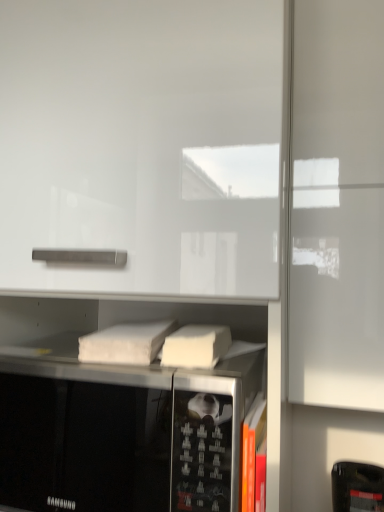
Question: Is black matte microwave oven at center wider than white matte book at center, arranged as the 1th book when viewed from the top?

Choices:
 (A) no
 (B) yes

Answer: (B)

Question: Is black matte microwave oven at center thinner than white matte book at center, which is the 2th book from right to left?

Choices:
 (A) yes
 (B) no

Answer: (B)

Question: Is black matte microwave oven at center facing away from white matte book at center, which is the 2th book from right to left?

Choices:
 (A) yes
 (B) no

Answer: (B)

Question: Does black matte microwave oven at center have a greater height compared to white matte book at center, which is counted as the 1th book, starting from the left?

Choices:
 (A) no
 (B) yes

Answer: (B)

Question: Would you consider black matte microwave oven at center to be distant from white matte book at center, the second book from the bottom?

Choices:
 (A) no
 (B) yes

Answer: (A)

Question: From the image's perspective, is black matte microwave oven at center below white matte book at center, which is the 2th book from right to left?

Choices:
 (A) yes
 (B) no

Answer: (A)

Question: Could you tell me if white matte book at center, the second book from the bottom, is turned towards black matte microwave oven at center?

Choices:
 (A) yes
 (B) no

Answer: (B)

Question: Is white matte book at center, the second book from the front, far away from black matte microwave oven at center?

Choices:
 (A) yes
 (B) no

Answer: (B)

Question: Is white matte book at center, the second book from the front, bigger than black matte microwave oven at center?

Choices:
 (A) yes
 (B) no

Answer: (B)

Question: Considering the relative sizes of white matte book at center, marked as the 1th book in a back-to-front arrangement, and black matte microwave oven at center in the image provided, is white matte book at center, marked as the 1th book in a back-to-front arrangement, taller than black matte microwave oven at center?

Choices:
 (A) no
 (B) yes

Answer: (A)

Question: From the image's perspective, is white matte book at center, which is the 2th book from right to left, below black matte microwave oven at center?

Choices:
 (A) yes
 (B) no

Answer: (B)

Question: Does white matte book at center, the second book from the front, come behind black matte microwave oven at center?

Choices:
 (A) yes
 (B) no

Answer: (A)

Question: From a real-world perspective, is white matte book at center, the second book from the bottom, over orange matte book at lower right, the first book in the bottom-to-top sequence?

Choices:
 (A) no
 (B) yes

Answer: (B)